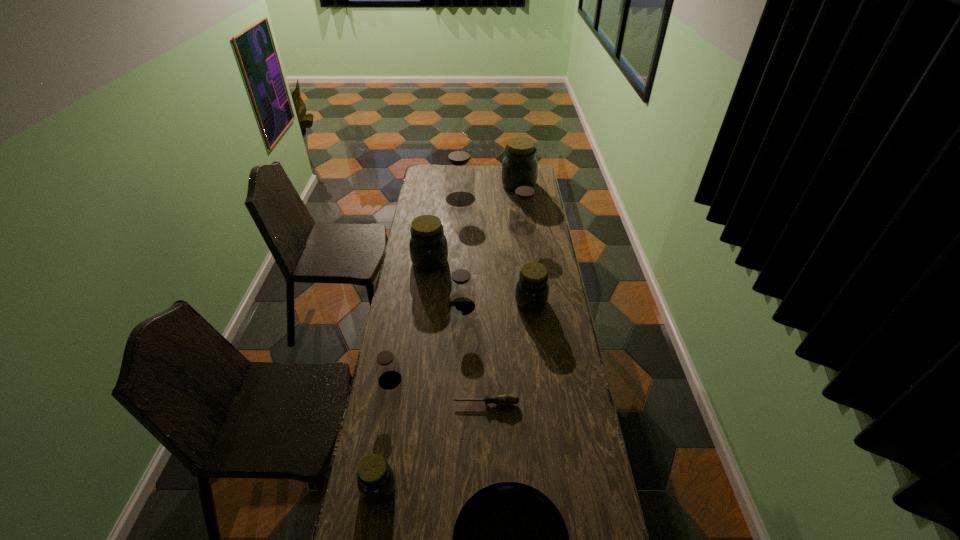
The image size is (960, 540). Find the location of `free space at the far left corner`. free space at the far left corner is located at coordinates (425, 180).

Identify the location of empty space that is in between the biggest brown jar and the nearest green jar. Image resolution: width=960 pixels, height=540 pixels. tap(420, 343).

Identify the location of vacant area that lies between the second farthest brown jar and the nearest jar. The width and height of the screenshot is (960, 540). (450, 358).

Identify the location of free space that is in between the biggest green jar and the second nearest brown jar. (491, 246).

Identify the location of vacant space that's between the biggest green jar and the farthest brown jar. (490, 192).

Identify the location of free spot between the nearest brown jar and the second nearest brown jar. Image resolution: width=960 pixels, height=540 pixels. (426, 343).

Where is `empty location between the biggest green jar and the third biggest green jar`? This screenshot has width=960, height=540. empty location between the biggest green jar and the third biggest green jar is located at coordinates (525, 243).

At what (x,y) coordinates should I click in order to perform the action: click on vacant space in between the biggest green jar and the shortest object. Please return your answer as a coordinate pair (x, y). Looking at the image, I should click on (502, 294).

You are a GUI agent. You are given a task and a screenshot of the screen. Output one action in this format:
    pyautogui.click(x=<x>, y=<y>)
    Task: Click on the unoccupied area between the shortest object and the fourth nearest object
    Image resolution: width=960 pixels, height=540 pixels.
    Given the screenshot: What is the action you would take?
    pyautogui.click(x=438, y=392)

Where is `vacant area that lies between the farthest green jar and the third nearest object`? Image resolution: width=960 pixels, height=540 pixels. vacant area that lies between the farthest green jar and the third nearest object is located at coordinates (502, 294).